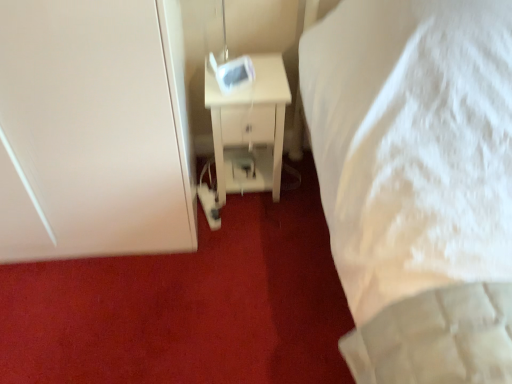
The height and width of the screenshot is (384, 512). In order to click on free location to the right of white glossy nightstand at center in this screenshot , I will do `click(298, 189)`.